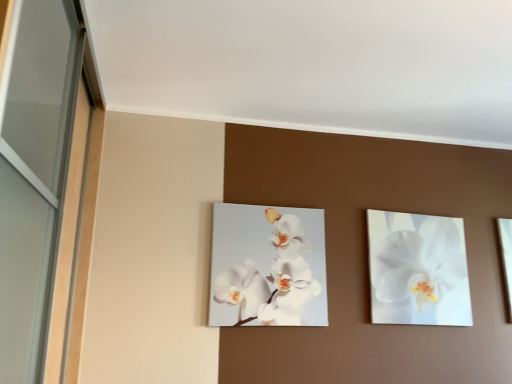
Question: Considering the positions of white glossy orchid at upper right, the second flower in the left-to-right sequence, and white glossy orchid at center, acting as the 2th flower starting from the right, in the image, is white glossy orchid at upper right, the second flower in the left-to-right sequence, bigger or smaller than white glossy orchid at center, acting as the 2th flower starting from the right,?

Choices:
 (A) small
 (B) big

Answer: (B)

Question: Is white glossy orchid at upper right, positioned as the first flower in right-to-left order, wider or thinner than white glossy orchid at center, acting as the 2th flower starting from the right?

Choices:
 (A) wide
 (B) thin

Answer: (A)

Question: From the image's perspective, relative to white glossy orchid at center, which is counted as the first flower, starting from the left, is white glossy orchid at upper right, positioned as the first flower in right-to-left order, above or below?

Choices:
 (A) above
 (B) below

Answer: (B)

Question: From the image's perspective, is white glossy orchid at center, acting as the 2th flower starting from the right, above or below white glossy orchid at upper right, the second flower in the left-to-right sequence?

Choices:
 (A) below
 (B) above

Answer: (B)

Question: Considering the positions of white glossy orchid at center, which is counted as the first flower, starting from the left, and white glossy orchid at upper right, the second flower in the left-to-right sequence, in the image, is white glossy orchid at center, which is counted as the first flower, starting from the left, taller or shorter than white glossy orchid at upper right, the second flower in the left-to-right sequence,?

Choices:
 (A) tall
 (B) short

Answer: (B)

Question: Looking at the image, does white glossy orchid at center, which is counted as the first flower, starting from the left, seem bigger or smaller compared to white glossy orchid at upper right, positioned as the first flower in right-to-left order?

Choices:
 (A) small
 (B) big

Answer: (A)

Question: Considering their positions, is white glossy orchid at center, which is counted as the first flower, starting from the left, located in front of or behind white glossy orchid at upper right, the second flower in the left-to-right sequence?

Choices:
 (A) front
 (B) behind

Answer: (A)